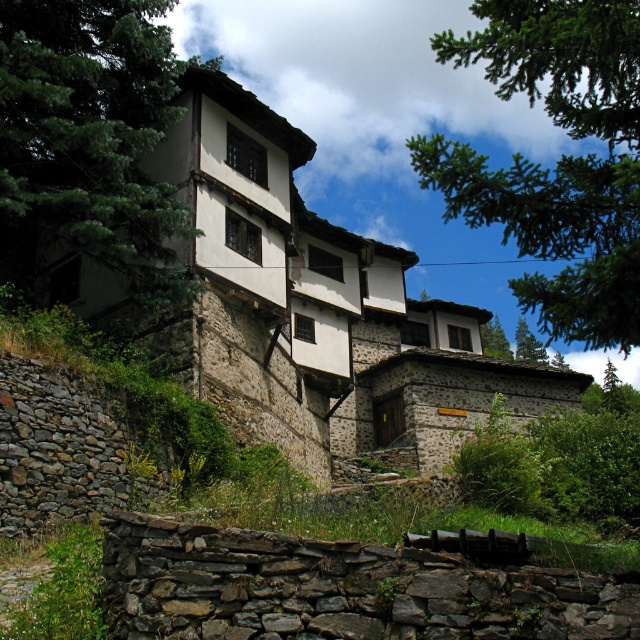
Measure the distance from green leafy tree at upper center to green leafy tree at upper left.

green leafy tree at upper center is 130.68 feet from green leafy tree at upper left.

Where is `green leafy tree at upper center`? This screenshot has height=640, width=640. green leafy tree at upper center is located at coordinates (556, 161).

Does green leafy tree at upper left appear on the left side of green leafy tree at center?

Yes, green leafy tree at upper left is to the left of green leafy tree at center.

Is green leafy tree at upper left shorter than green leafy tree at center?

No, green leafy tree at upper left is not shorter than green leafy tree at center.

The image size is (640, 640). What are the coordinates of `green leafy tree at upper left` in the screenshot? It's located at (88, 140).

Between point (548, 186) and point (493, 353), which one is positioned behind?

Point (493, 353)

Does green leafy tree at upper center appear on the right side of green leafy tree at center?

No, green leafy tree at upper center is not to the right of green leafy tree at center.

Find the location of a particular element. green leafy tree at upper center is located at coordinates (556, 161).